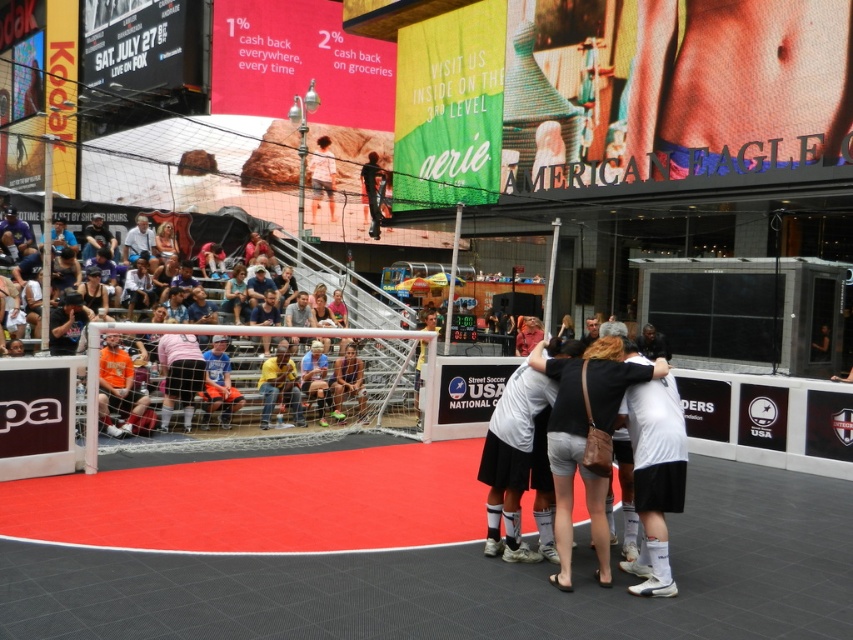
Between orange fabric seats at lower left and dark blue jeans at upper center, which one appears on the left side from the viewer's perspective?

orange fabric seats at lower left

Between orange fabric seats at lower left and dark blue jeans at upper center, which one is positioned higher?

Positioned higher is dark blue jeans at upper center.

Is point (39, 246) positioned before point (367, 154)?

Yes.

You are a GUI agent. You are given a task and a screenshot of the screen. Output one action in this format:
    pyautogui.click(x=<x>, y=<y>)
    Task: Click on the orange fabric seats at lower left
    
    Given the screenshot: What is the action you would take?
    pyautogui.click(x=169, y=220)

Who is taller, light brown leather jacket at center or dark blue jeans at upper center?

Standing taller between the two is dark blue jeans at upper center.

Which is in front, point (317, 170) or point (381, 212)?

Positioned in front is point (381, 212).

At what (x,y) coordinates should I click in order to perform the action: click on light brown leather jacket at center. Please return your answer as a coordinate pair (x, y). Looking at the image, I should click on (322, 176).

Between point (70, 204) and point (335, 180), which one is positioned behind?

Positioned behind is point (335, 180).

Does orange fabric seats at lower left appear on the left side of light brown leather jacket at center?

Yes, orange fabric seats at lower left is to the left of light brown leather jacket at center.

Is point (140, 205) positioned in front of point (318, 140)?

Yes, it is in front of point (318, 140).

At what (x,y) coordinates should I click in order to perform the action: click on orange fabric seats at lower left. Please return your answer as a coordinate pair (x, y). Looking at the image, I should click on (169, 220).